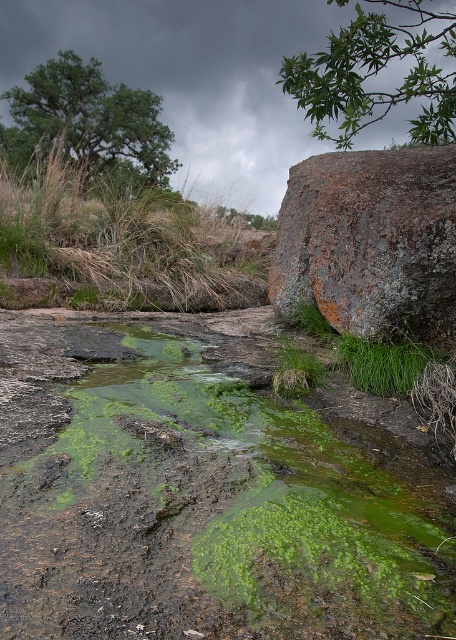
Does green mossy rock at center appear on the left side of green mossy algae at upper left?

In fact, green mossy rock at center is to the right of green mossy algae at upper left.

Can you confirm if green mossy rock at center is positioned above green mossy algae at upper left?

Incorrect, green mossy rock at center is not positioned above green mossy algae at upper left.

Is point (358, 481) positioned after point (62, 227)?

No, (358, 481) is in front of (62, 227).

You are a GUI agent. You are given a task and a screenshot of the screen. Output one action in this format:
    pyautogui.click(x=<x>, y=<y>)
    Task: Click on the green mossy rock at center
    This screenshot has width=456, height=640.
    Given the screenshot: What is the action you would take?
    pyautogui.click(x=212, y=516)

Is rusty rock at upper right above green mossy algae at upper left?

No, rusty rock at upper right is not above green mossy algae at upper left.

Can you confirm if rusty rock at upper right is thinner than green mossy algae at upper left?

Indeed, rusty rock at upper right has a lesser width compared to green mossy algae at upper left.

Identify the location of rusty rock at upper right. (372, 241).

This screenshot has height=640, width=456. I want to click on rusty rock at upper right, so click(x=372, y=241).

Who is more forward, (190,380) or (346,330)?

Positioned in front is point (190,380).

Does green mossy rock at center have a lesser height compared to rusty rock at upper right?

Correct, green mossy rock at center is not as tall as rusty rock at upper right.

Between point (267, 579) and point (421, 228), which one is positioned behind?

The point (421, 228) is more distant.

Locate an element on the screen. This screenshot has width=456, height=640. green mossy rock at center is located at coordinates (212, 516).